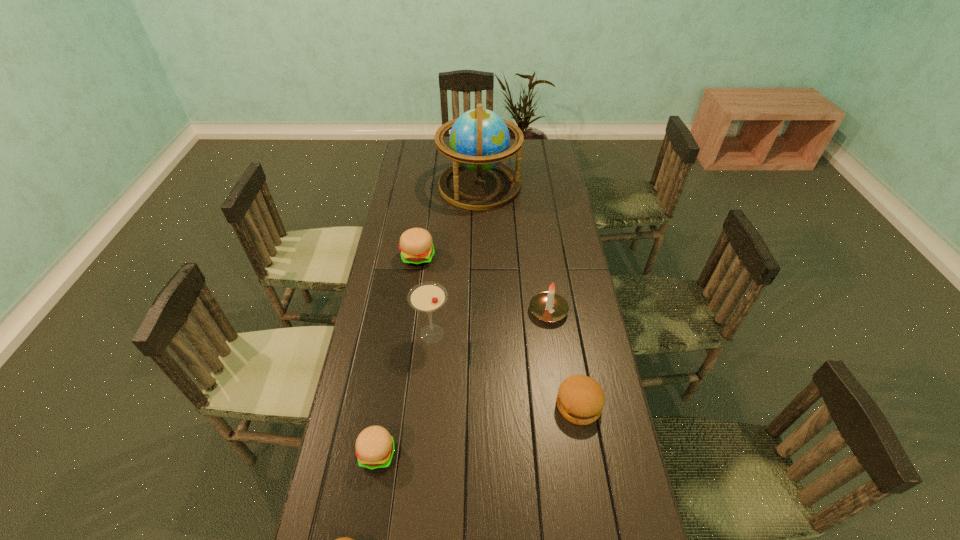
The image size is (960, 540). Identify the location of the smaller beige hamburger. (375, 447).

At what (x,y) coordinates should I click in order to perform the action: click on vacant space located 0.170m on the right of the globe. Please return your answer as a coordinate pair (x, y). The width and height of the screenshot is (960, 540). Looking at the image, I should click on (558, 186).

At what (x,y) coordinates should I click in order to perform the action: click on vacant area situated on the left of the sixth shortest object. Please return your answer as a coordinate pair (x, y). The image size is (960, 540). Looking at the image, I should click on (386, 334).

Find the location of a particular element. Image resolution: width=960 pixels, height=540 pixels. free point located on the front of the fifth shortest object is located at coordinates (557, 374).

Identify the location of free region located on the back of the bigger beige hamburger. This screenshot has width=960, height=540. (425, 204).

I want to click on free space located on the left of the third nearest hamburger, so click(x=448, y=405).

You are a GUI agent. You are given a task and a screenshot of the screen. Output one action in this format:
    pyautogui.click(x=<x>, y=<y>)
    Task: Click on the vacant space situated on the back of the second nearest hamburger
    This screenshot has height=540, width=960.
    Given the screenshot: What is the action you would take?
    pyautogui.click(x=396, y=342)

Identify the location of object that is at the far edge. The height and width of the screenshot is (540, 960). (479, 139).

At what (x,y) coordinates should I click in order to perform the action: click on candle positioned at the right edge. Please return your answer as a coordinate pair (x, y). The image size is (960, 540). Looking at the image, I should click on (549, 306).

Identify the location of hamburger positioned at the right edge. (580, 400).